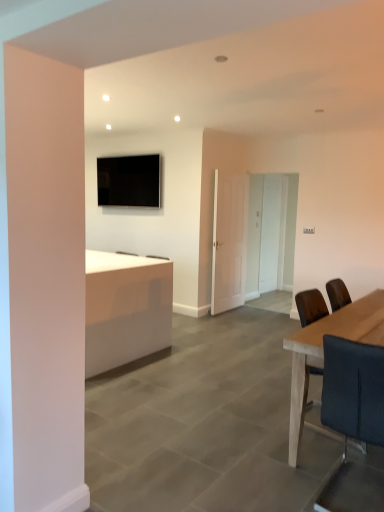
Question: From a real-world perspective, is white matte door at center physically located above or below matte black tv at upper center?

Choices:
 (A) below
 (B) above

Answer: (A)

Question: Is white matte door at center in front of or behind matte black tv at upper center in the image?

Choices:
 (A) behind
 (B) front

Answer: (B)

Question: Which of these objects is positioned closest to the black leather chair at right?

Choices:
 (A) light brown wooden table at right
 (B) white matte door at center
 (C) matte black tv at upper center
 (D) white glossy desk at center
 (E) transparent glass door at center

Answer: (A)

Question: Estimate the real-world distances between objects in this image. Which object is farther from the black leather chair at right?

Choices:
 (A) white glossy desk at center
 (B) matte black tv at upper center
 (C) light brown wooden table at right
 (D) white matte door at center
 (E) transparent glass door at center

Answer: (E)